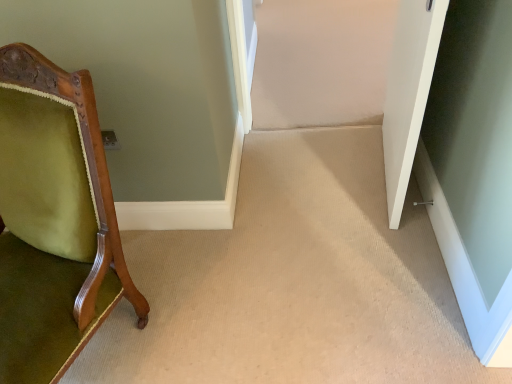
Question: Is green velvet chair at left facing towards clear glass door at lower right?

Choices:
 (A) no
 (B) yes

Answer: (A)

Question: Is green velvet chair at left not near clear glass door at lower right?

Choices:
 (A) yes
 (B) no

Answer: (A)

Question: Is green velvet chair at left positioned before clear glass door at lower right?

Choices:
 (A) yes
 (B) no

Answer: (A)

Question: Is green velvet chair at left shorter than clear glass door at lower right?

Choices:
 (A) no
 (B) yes

Answer: (A)

Question: Does green velvet chair at left have a smaller size compared to clear glass door at lower right?

Choices:
 (A) no
 (B) yes

Answer: (A)

Question: Looking at their shapes, would you say white matte door at right is wider or thinner than clear glass door at lower right?

Choices:
 (A) wide
 (B) thin

Answer: (A)

Question: From the image's perspective, is white matte door at right located above or below clear glass door at lower right?

Choices:
 (A) above
 (B) below

Answer: (A)

Question: Considering the positions of point (400, 192) and point (440, 99), is point (400, 192) closer or farther from the camera than point (440, 99)?

Choices:
 (A) closer
 (B) farther

Answer: (A)

Question: Looking at the image, does white matte door at right seem bigger or smaller compared to clear glass door at lower right?

Choices:
 (A) small
 (B) big

Answer: (B)

Question: In the image, is clear glass door at lower right on the left side or the right side of green velvet chair at left?

Choices:
 (A) left
 (B) right

Answer: (B)

Question: Considering the positions of point (486, 309) and point (42, 312), is point (486, 309) closer or farther from the camera than point (42, 312)?

Choices:
 (A) farther
 (B) closer

Answer: (A)

Question: Relative to green velvet chair at left, is clear glass door at lower right in front or behind?

Choices:
 (A) behind
 (B) front

Answer: (A)

Question: Choose the correct answer: Is clear glass door at lower right inside green velvet chair at left or outside it?

Choices:
 (A) outside
 (B) inside

Answer: (A)

Question: From the image's perspective, relative to clear glass door at lower right, is green velvet chair at left above or below?

Choices:
 (A) below
 (B) above

Answer: (B)

Question: Is point (52, 193) closer or farther from the camera than point (498, 185)?

Choices:
 (A) farther
 (B) closer

Answer: (B)